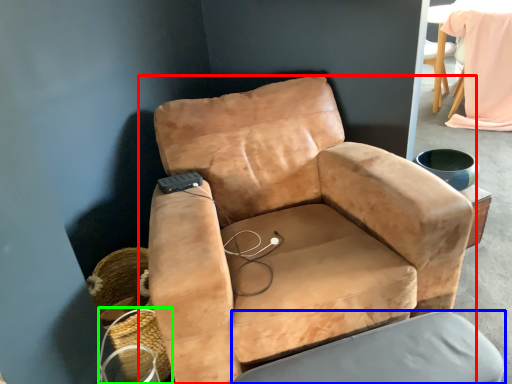
Question: Estimate the real-world distances between objects in this image. Which object is farther from chair (highlighted by a red box), swivel chair (highlighted by a blue box) or basket (highlighted by a green box)?

Choices:
 (A) swivel chair
 (B) basket

Answer: (B)